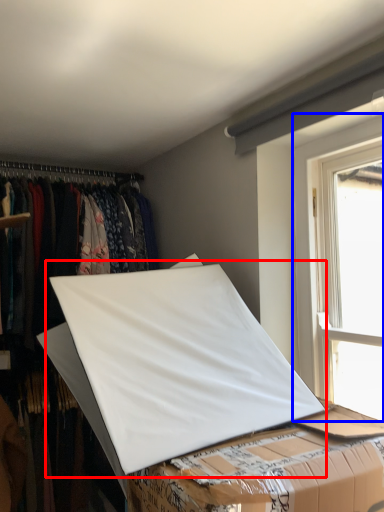
Question: Among these objects, which one is nearest to the camera, linen (highlighted by a red box) or window (highlighted by a blue box)?

Choices:
 (A) linen
 (B) window

Answer: (A)